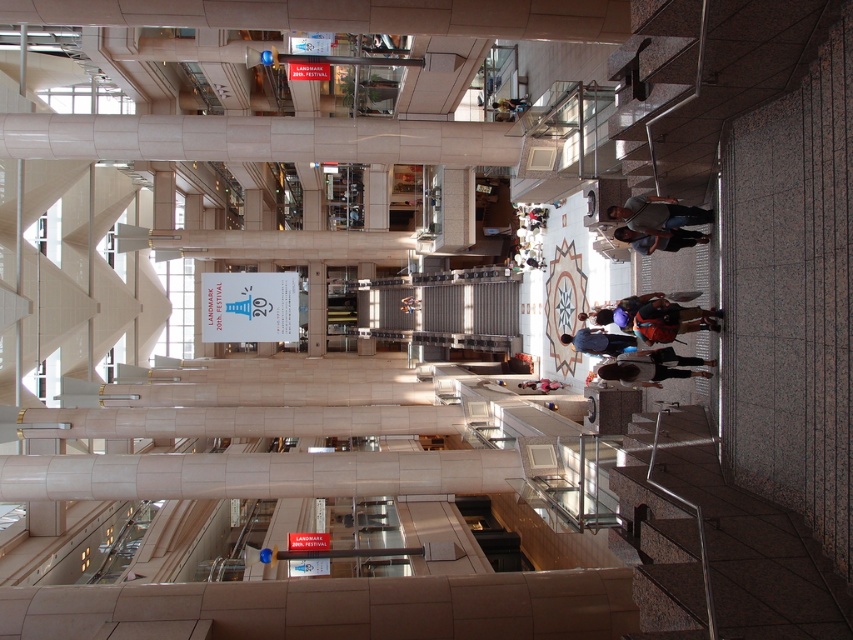
You are a security guard in the mall and you see an orange fabric backpack at center and a dark blue shirt at right. Which object is located more to the right side?

The orange fabric backpack at center is positioned on the right side of dark blue shirt at right, so the orange fabric backpack at center is more to the right side.

You are standing at the entrance of the shopping mall and see the dark blue jeans at center displayed in the middle of the floor. If you want to reach them quickly, should you take the staircase or the elevator?

The dark blue jeans at center are 23.60 meters away from you. Since the elevator would require waiting and taking the staircase directly leads towards them, taking the staircase would be faster to reach the dark blue jeans at center.

You are a store employee who needs to carry both the orange fabric backpack at center and the orange fabric bag at center. Which one can hold more items?

The orange fabric backpack at center is larger in size than the orange fabric bag at center, so it can hold more items.